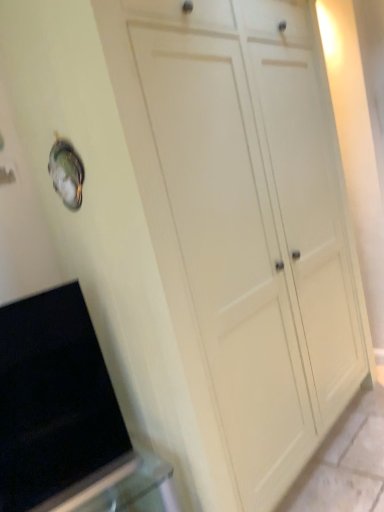
You are a GUI agent. You are given a task and a screenshot of the screen. Output one action in this format:
    pyautogui.click(x=<x>, y=<y>)
    Task: Click on the black matte oven at lower left
    Image resolution: width=384 pixels, height=512 pixels.
    Given the screenshot: What is the action you would take?
    point(53,400)

The height and width of the screenshot is (512, 384). Describe the element at coordinates (53, 400) in the screenshot. I see `black matte oven at lower left` at that location.

The height and width of the screenshot is (512, 384). Describe the element at coordinates (245, 224) in the screenshot. I see `white matte cupboard at center` at that location.

At what (x,y) coordinates should I click in order to perform the action: click on white matte cupboard at center. Please return your answer as a coordinate pair (x, y). Looking at the image, I should click on (245, 224).

Locate an element on the screen. The width and height of the screenshot is (384, 512). black matte oven at lower left is located at coordinates (53, 400).

In the scene shown: Which object is positioned more to the left, white matte cupboard at center or black matte oven at lower left?

From the viewer's perspective, black matte oven at lower left appears more on the left side.

Is white matte cupboard at center in front of or behind black matte oven at lower left in the image?

white matte cupboard at center is in front of black matte oven at lower left.

Is point (221, 59) closer to viewer compared to point (80, 391)?

No.

From the image's perspective, is white matte cupboard at center under black matte oven at lower left?

No, from the image's perspective, white matte cupboard at center is not beneath black matte oven at lower left.

From a real-world perspective, between white matte cupboard at center and black matte oven at lower left, who is vertically higher?

white matte cupboard at center is physically above.

Considering the relative sizes of white matte cupboard at center and black matte oven at lower left in the image provided, is white matte cupboard at center thinner than black matte oven at lower left?

No.

Which of these two, white matte cupboard at center or black matte oven at lower left, stands taller?

white matte cupboard at center.

Between white matte cupboard at center and black matte oven at lower left, which one has larger size?

white matte cupboard at center is bigger.

Is white matte cupboard at center not within black matte oven at lower left?

Yes.

Is white matte cupboard at center not near black matte oven at lower left?

No, white matte cupboard at center is not far from black matte oven at lower left.

Is black matte oven at lower left at the back of white matte cupboard at center?

No.

Can you tell me how much white matte cupboard at center and black matte oven at lower left differ in facing direction?

The angular difference between white matte cupboard at center and black matte oven at lower left is 14.3 degrees.

The height and width of the screenshot is (512, 384). I want to click on appliance that appears on the left of white matte cupboard at center, so click(x=53, y=400).

Considering the positions of objects black matte oven at lower left and white matte cupboard at center in the image provided, who is more to the left, black matte oven at lower left or white matte cupboard at center?

black matte oven at lower left is more to the left.

Is black matte oven at lower left closer to camera compared to white matte cupboard at center?

No.

Considering the points (16, 347) and (152, 115), which point is in front, point (16, 347) or point (152, 115)?

The point (152, 115) is closer to the camera.

From the picture: From the image's perspective, which one is positioned higher, black matte oven at lower left or white matte cupboard at center?

white matte cupboard at center, from the image's perspective.

From a real-world perspective, is black matte oven at lower left beneath white matte cupboard at center?

Yes, from a real-world perspective, black matte oven at lower left is under white matte cupboard at center.

From the picture: Is black matte oven at lower left wider than white matte cupboard at center?

In fact, black matte oven at lower left might be narrower than white matte cupboard at center.

Who is taller, black matte oven at lower left or white matte cupboard at center?

white matte cupboard at center.

Considering the sizes of objects black matte oven at lower left and white matte cupboard at center in the image provided, who is bigger, black matte oven at lower left or white matte cupboard at center?

white matte cupboard at center.

Is black matte oven at lower left completely or partially outside of white matte cupboard at center?

Yes, black matte oven at lower left is outside of white matte cupboard at center.

From the picture: Is black matte oven at lower left beside white matte cupboard at center?

black matte oven at lower left and white matte cupboard at center are clearly separated.

Is black matte oven at lower left turned away from white matte cupboard at center?

black matte oven at lower left is not turned away from white matte cupboard at center.

How far apart are black matte oven at lower left and white matte cupboard at center?

The distance of black matte oven at lower left from white matte cupboard at center is 70.93 centimeters.

Find the location of `cupboard that is above the black matte oven at lower left (from a real-world perspective)`. cupboard that is above the black matte oven at lower left (from a real-world perspective) is located at coordinates (245, 224).

The height and width of the screenshot is (512, 384). I want to click on cupboard on the right of black matte oven at lower left, so click(245, 224).

Locate an element on the screen. cupboard above the black matte oven at lower left (from the image's perspective) is located at coordinates (245, 224).